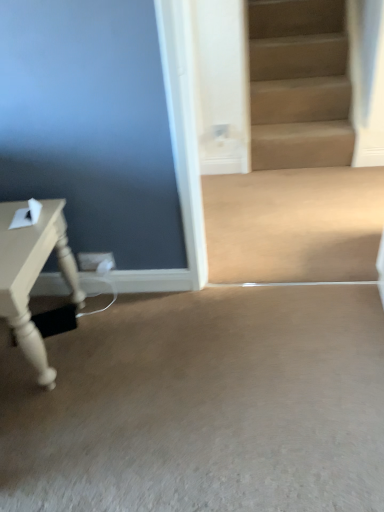
Question: Would you say beige carpet at lower center, the 2th concrete when ordered from top to bottom, is inside or outside matte white table at left?

Choices:
 (A) inside
 (B) outside

Answer: (B)

Question: Is beige carpet at lower center, which is counted as the first concrete, starting from the bottom, to the left or to the right of matte white table at left in the image?

Choices:
 (A) right
 (B) left

Answer: (A)

Question: Which of these objects is positioned closest to the beige carpet at lower center, marked as the 2th concrete in a back-to-front arrangement?

Choices:
 (A) matte white table at left
 (B) beige smooth concrete at center, acting as the 1th concrete starting from the back

Answer: (A)

Question: Estimate the real-world distances between objects in this image. Which object is farther from the beige carpet at lower center, which ranks as the 1th concrete in front-to-back order?

Choices:
 (A) matte white table at left
 (B) beige smooth concrete at center, which appears as the 1th concrete when viewed from the top

Answer: (B)